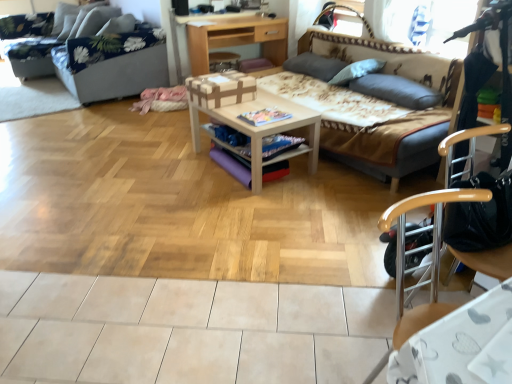
Question: Looking at the image, does wooden desk at center seem bigger or smaller compared to gray fabric pillow at upper right, the second pillow viewed from the back?

Choices:
 (A) big
 (B) small

Answer: (A)

Question: Considering the positions of wooden desk at center and gray fabric pillow at upper right, marked as the second pillow in a front-to-back arrangement, in the image, is wooden desk at center taller or shorter than gray fabric pillow at upper right, marked as the second pillow in a front-to-back arrangement,?

Choices:
 (A) short
 (B) tall

Answer: (B)

Question: Which of these objects is positioned farthest from the white wood table at center?

Choices:
 (A) wooden desk at center
 (B) brown fabric studio couch at center, which is the 2th studio couch in left-to-right order
 (C) gray fabric pillow at upper right, the second pillow viewed from the back
 (D) gray fabric pillow at upper right, marked as the first pillow in a front-to-back arrangement
 (E) floral fabric studio couch at upper left, the first studio couch when ordered from left to right

Answer: (E)

Question: Which object is the closest to the gray fabric pillow at upper right, marked as the first pillow in a front-to-back arrangement?

Choices:
 (A) floral fabric studio couch at upper left, arranged as the 2th studio couch when viewed from the right
 (B) white wood table at center
 (C) gray fabric pillow at upper right, marked as the second pillow in a front-to-back arrangement
 (D) brown fabric studio couch at center, which is the 2th studio couch in left-to-right order
 (E) wooden desk at center

Answer: (D)